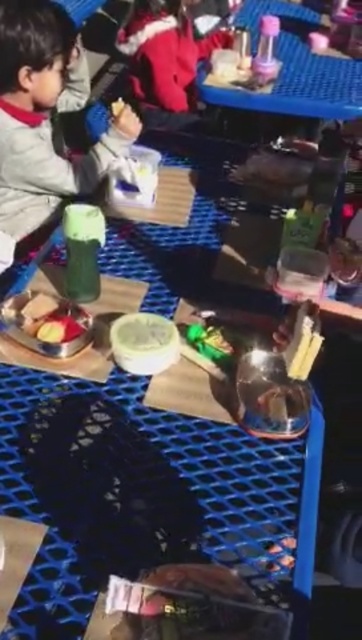
In the scene shown: You are a customer at the food stall and want to place your matte gray jacket at left on the nearest available surface. Which object from the scene can you use as a surface to place it?

The matte gray jacket at left can be placed on the blue plastic table with a grid like pattern since it is the nearest available surface in the scene.